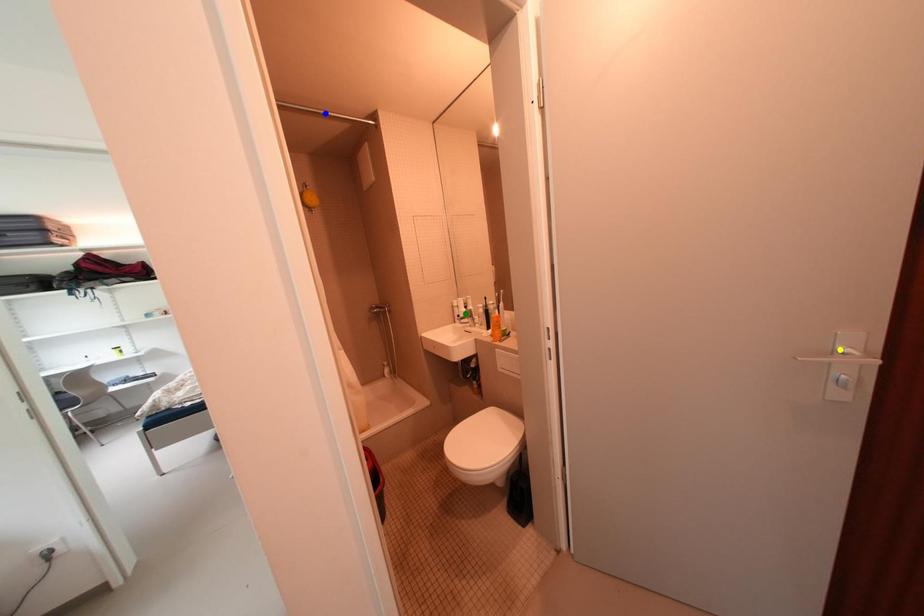
Order these from nearest to farthest:
- blue point
- green point
- yellow point

yellow point
blue point
green point